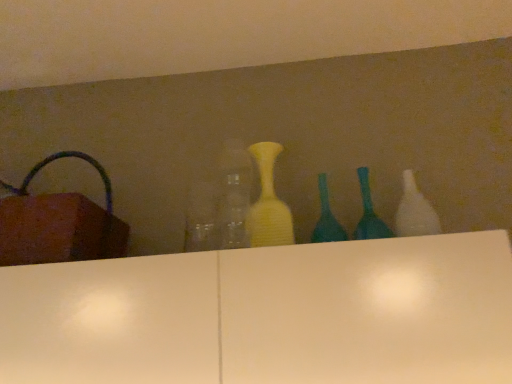
Question: Does transparent glass bottle at center, which is the fifth bottle from right to left, come behind teal glass bottle at center, the 3th bottle when ordered from left to right?

Choices:
 (A) yes
 (B) no

Answer: (B)

Question: Considering the relative sizes of transparent glass bottle at center, which is the fifth bottle from right to left, and teal glass bottle at center, the 3th bottle when ordered from left to right, in the image provided, is transparent glass bottle at center, which is the fifth bottle from right to left, bigger than teal glass bottle at center, the 3th bottle when ordered from left to right,?

Choices:
 (A) no
 (B) yes

Answer: (B)

Question: Is transparent glass bottle at center, which is the fifth bottle from right to left, wider than teal glass bottle at center, which is the 3th bottle in right-to-left order?

Choices:
 (A) no
 (B) yes

Answer: (B)

Question: From the image's perspective, is transparent glass bottle at center, which appears as the 1th bottle when viewed from the left, beneath teal glass bottle at center, the 3th bottle when ordered from left to right?

Choices:
 (A) yes
 (B) no

Answer: (B)

Question: From the image's perspective, does transparent glass bottle at center, which is the fifth bottle from right to left, appear higher than teal glass bottle at center, the 3th bottle when ordered from left to right?

Choices:
 (A) no
 (B) yes

Answer: (B)

Question: In terms of size, does transparent glass bottle at center, which appears as the 1th bottle when viewed from the left, appear bigger or smaller than white glossy bottle at right, arranged as the 1th bottle when viewed from the right?

Choices:
 (A) big
 (B) small

Answer: (A)

Question: Is transparent glass bottle at center, which is the fifth bottle from right to left, in front of or behind white glossy bottle at right, arranged as the 1th bottle when viewed from the right, in the image?

Choices:
 (A) front
 (B) behind

Answer: (A)

Question: Is transparent glass bottle at center, which is the fifth bottle from right to left, wider or thinner than white glossy bottle at right, which is counted as the fifth bottle, starting from the left?

Choices:
 (A) wide
 (B) thin

Answer: (A)

Question: From the image's perspective, is transparent glass bottle at center, which is the fifth bottle from right to left, positioned above or below white glossy bottle at right, which is counted as the fifth bottle, starting from the left?

Choices:
 (A) below
 (B) above

Answer: (A)

Question: Choose the correct answer: Is transparent glass bottle at center, which appears as the 1th bottle when viewed from the left, inside teal glass bottle at center, placed as the second bottle when sorted from right to left, or outside it?

Choices:
 (A) inside
 (B) outside

Answer: (B)

Question: Is transparent glass bottle at center, which appears as the 1th bottle when viewed from the left, bigger or smaller than teal glass bottle at center, placed as the second bottle when sorted from right to left?

Choices:
 (A) small
 (B) big

Answer: (B)

Question: From a real-world perspective, is transparent glass bottle at center, which appears as the 1th bottle when viewed from the left, above or below teal glass bottle at center, placed as the second bottle when sorted from right to left?

Choices:
 (A) below
 (B) above

Answer: (B)

Question: From the image's perspective, is transparent glass bottle at center, which is the fifth bottle from right to left, located above or below teal glass bottle at center, which ranks as the fourth bottle in left-to-right order?

Choices:
 (A) above
 (B) below

Answer: (A)

Question: Does point (359, 223) appear closer or farther from the camera than point (412, 215)?

Choices:
 (A) farther
 (B) closer

Answer: (A)

Question: In terms of width, does teal glass bottle at center, placed as the second bottle when sorted from right to left, look wider or thinner when compared to white glossy bottle at right, which is counted as the fifth bottle, starting from the left?

Choices:
 (A) wide
 (B) thin

Answer: (B)